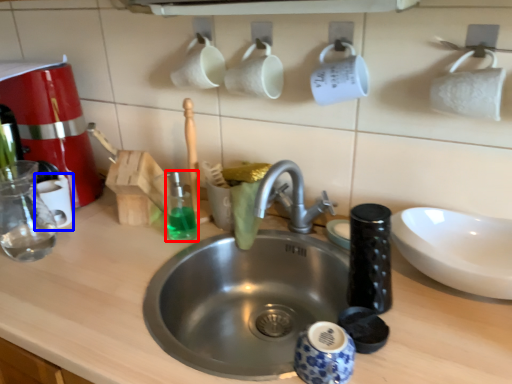
Question: Among these objects, which one is nearest to the camera, cleaning product (highlighted by a red box) or mug (highlighted by a blue box)?

Choices:
 (A) cleaning product
 (B) mug

Answer: (A)